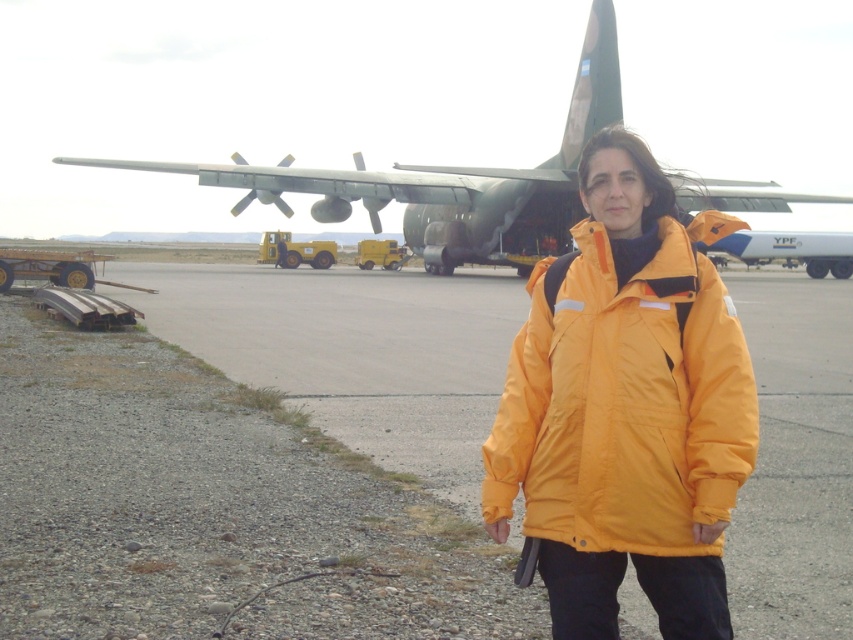
Question: Which of these objects is positioned closest to the green matte airplane at upper center?

Choices:
 (A) yellow matte jacket at center
 (B) smooth asphalt tarmac at center

Answer: (B)

Question: Does smooth asphalt tarmac at center appear on the left side of yellow matte jacket at center?

Choices:
 (A) no
 (B) yes

Answer: (A)

Question: Can you confirm if smooth asphalt tarmac at center is thinner than yellow matte jacket at center?

Choices:
 (A) no
 (B) yes

Answer: (A)

Question: Which of the following is the farthest from the observer?

Choices:
 (A) green matte airplane at upper center
 (B) yellow matte jacket at center
 (C) smooth asphalt tarmac at center

Answer: (A)

Question: Which point appears closest to the camera in this image?

Choices:
 (A) (497, 186)
 (B) (200, 320)
 (C) (619, 257)

Answer: (C)

Question: Is smooth asphalt tarmac at center positioned before green matte airplane at upper center?

Choices:
 (A) no
 (B) yes

Answer: (B)